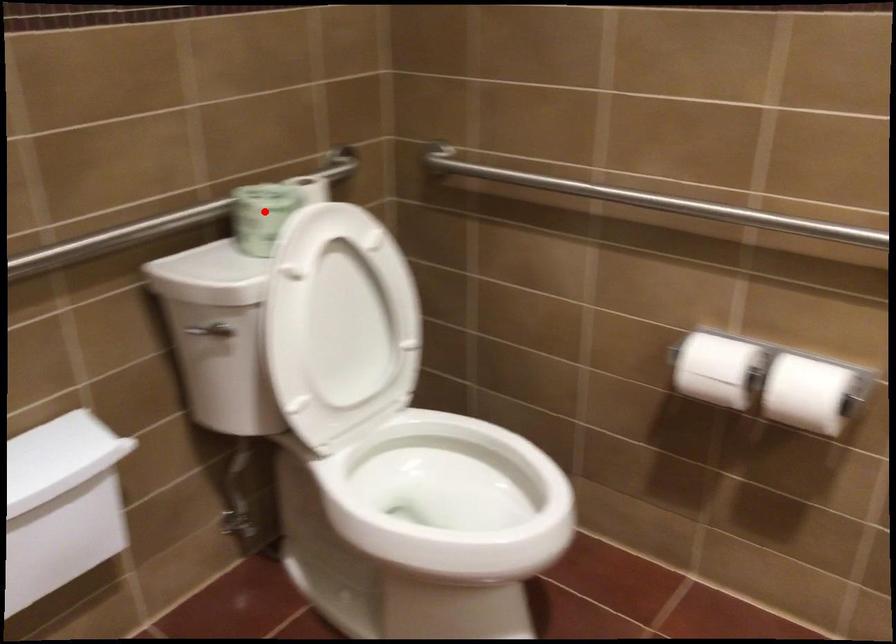
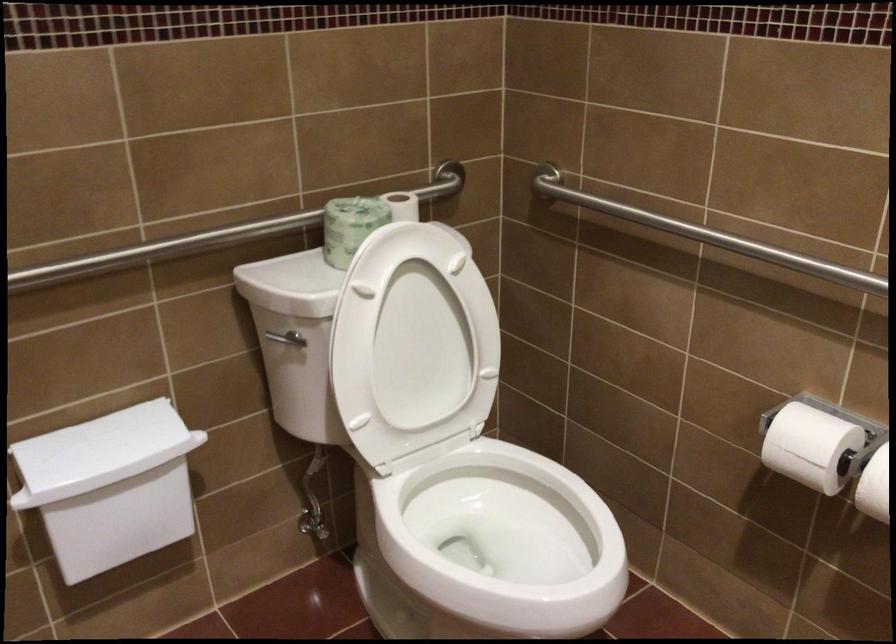
Question: I am providing you with two images of the same scene from different viewpoints. A red point is marked on the first image. Can you still see the location of the red point in image 2?

Choices:
 (A) Yes
 (B) No

Answer: (A)